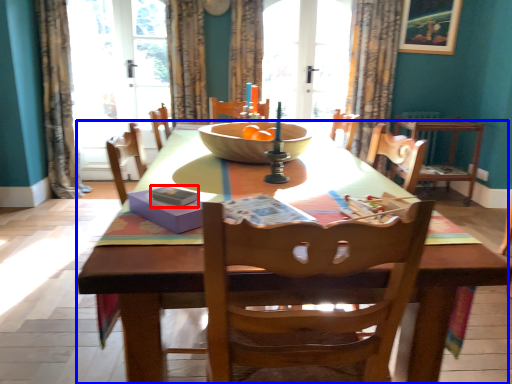
Question: Which of the following is the closest to the observer, magazine (highlighted by a red box) or kitchen & dining room table (highlighted by a blue box)?

Choices:
 (A) magazine
 (B) kitchen & dining room table

Answer: (B)